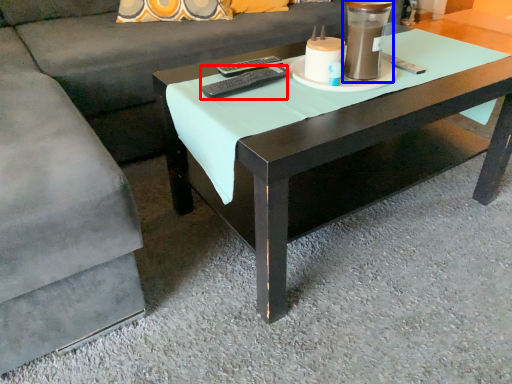
Question: Which point is further to the camera, remote (highlighted by a red box) or candle holder (highlighted by a blue box)?

Choices:
 (A) remote
 (B) candle holder

Answer: (A)